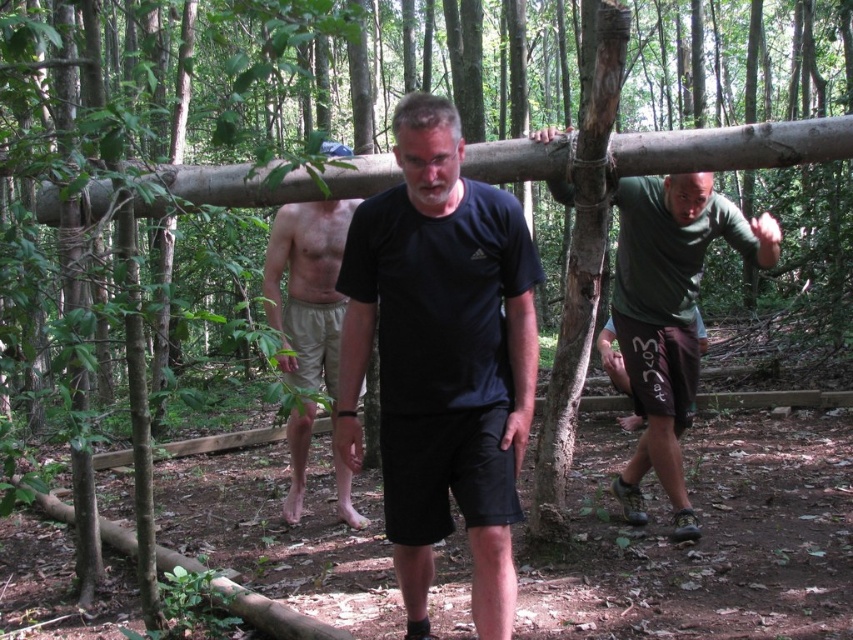
Question: Which object is the farthest from the tan cotton shorts at center?

Choices:
 (A) dark green jersey at upper right
 (B) smooth wood beam at center
 (C) black matte t-shirt at center

Answer: (A)

Question: Which point appears closest to the camera in this image?

Choices:
 (A) (675, 168)
 (B) (683, 419)
 (C) (363, 528)

Answer: (A)

Question: Does black matte t-shirt at center appear under dark green jersey at upper right?

Choices:
 (A) no
 (B) yes

Answer: (B)

Question: Does dark green jersey at upper right lie in front of tan cotton shorts at center?

Choices:
 (A) no
 (B) yes

Answer: (A)

Question: Is black matte t-shirt at center bigger than dark green jersey at upper right?

Choices:
 (A) yes
 (B) no

Answer: (B)

Question: Based on their relative distances, which object is farther from the black matte t-shirt at center?

Choices:
 (A) smooth wood beam at center
 (B) tan cotton shorts at center
 (C) dark green jersey at upper right

Answer: (C)